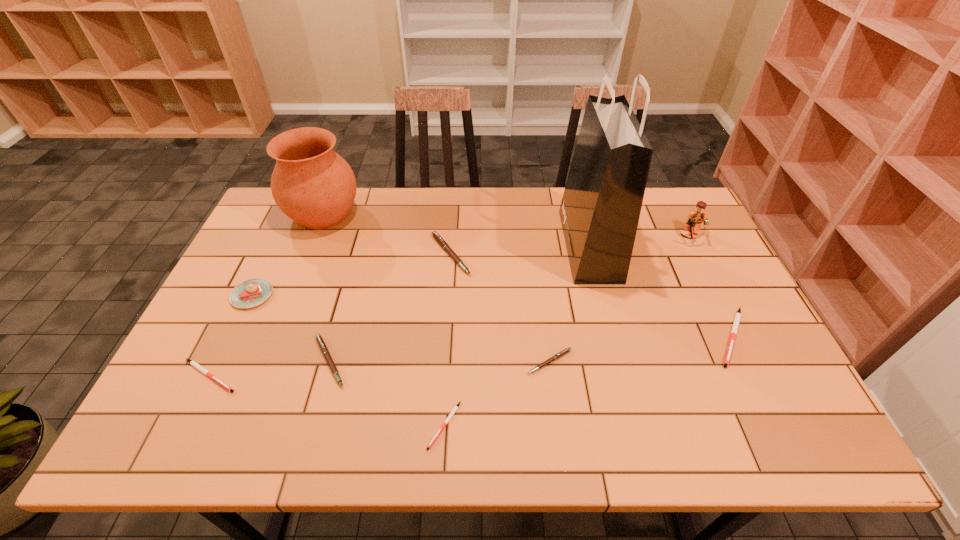
The image size is (960, 540). Find the location of `free space at the near edge`. free space at the near edge is located at coordinates (458, 415).

What are the coordinates of `free location at the left edge of the desktop` in the screenshot? It's located at (253, 243).

What are the coordinates of `vacant space at the right edge` in the screenshot? It's located at (743, 309).

You are a GUI agent. You are given a task and a screenshot of the screen. Output one action in this format:
    pyautogui.click(x=<x>, y=<y>)
    Task: Click on the free location at the far left corner of the desktop
    
    Given the screenshot: What is the action you would take?
    pyautogui.click(x=270, y=230)

I want to click on vacant space at the near left corner of the desktop, so click(x=150, y=434).

Identify the location of free space between the tallest object and the pastry. (420, 270).

At what (x,y) coordinates should I click in order to perform the action: click on free area in between the second white pen from left to right and the third tallest object. Please return your answer as a coordinate pair (x, y). This screenshot has width=960, height=540. Looking at the image, I should click on (567, 330).

Where is `vacant area that lies between the pottery and the second smallest pink pen`? The image size is (960, 540). vacant area that lies between the pottery and the second smallest pink pen is located at coordinates (326, 287).

The height and width of the screenshot is (540, 960). What are the coordinates of `free point between the second tallest object and the pastry` in the screenshot? It's located at (288, 254).

The image size is (960, 540). Find the location of `free spot between the leftmost pen and the second pink pen from left to right`. free spot between the leftmost pen and the second pink pen from left to right is located at coordinates (330, 315).